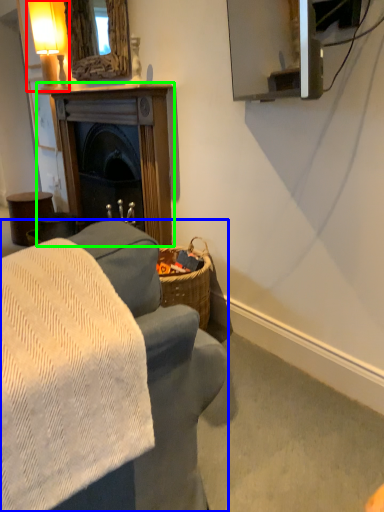
Question: Which is nearer to the table lamp (highlighted by a red box)? studio couch (highlighted by a blue box) or fireplace (highlighted by a green box).

Choices:
 (A) studio couch
 (B) fireplace

Answer: (B)